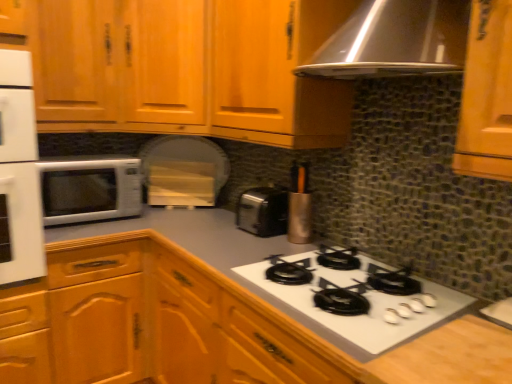
Locate an element on the screen. This screenshot has width=512, height=384. free space between white glossy gas stove at center and metallic silver utensil holder at upper center is located at coordinates (273, 248).